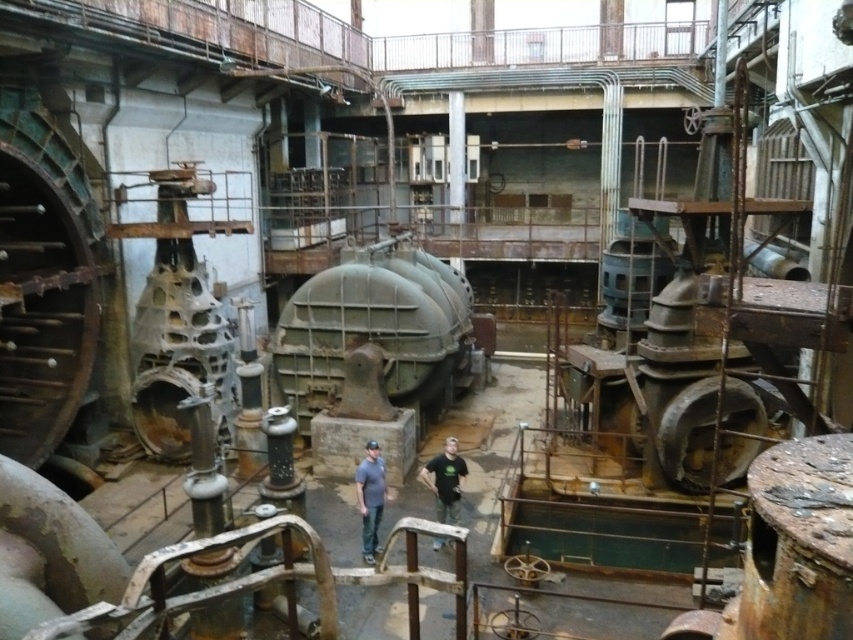
Question: Can you confirm if matte gray shirt at center is positioned to the left of black cotton shirt at center?

Choices:
 (A) no
 (B) yes

Answer: (B)

Question: Does matte gray shirt at center have a larger size compared to black cotton shirt at center?

Choices:
 (A) no
 (B) yes

Answer: (A)

Question: Is matte gray shirt at center further to the viewer compared to black cotton shirt at center?

Choices:
 (A) no
 (B) yes

Answer: (A)

Question: Among these points, which one is nearest to the camera?

Choices:
 (A) (366, 522)
 (B) (451, 500)

Answer: (A)

Question: Which point is closer to the camera?

Choices:
 (A) (368, 550)
 (B) (444, 458)

Answer: (A)